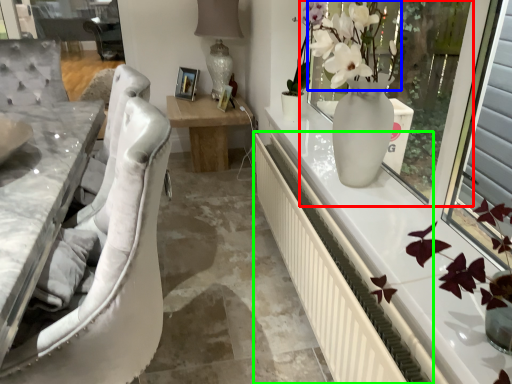
Question: Considering the real-world distances, which object is farthest from window screen (highlighted by a red box)? floral arrangement (highlighted by a blue box) or radiator (highlighted by a green box)?

Choices:
 (A) floral arrangement
 (B) radiator

Answer: (B)